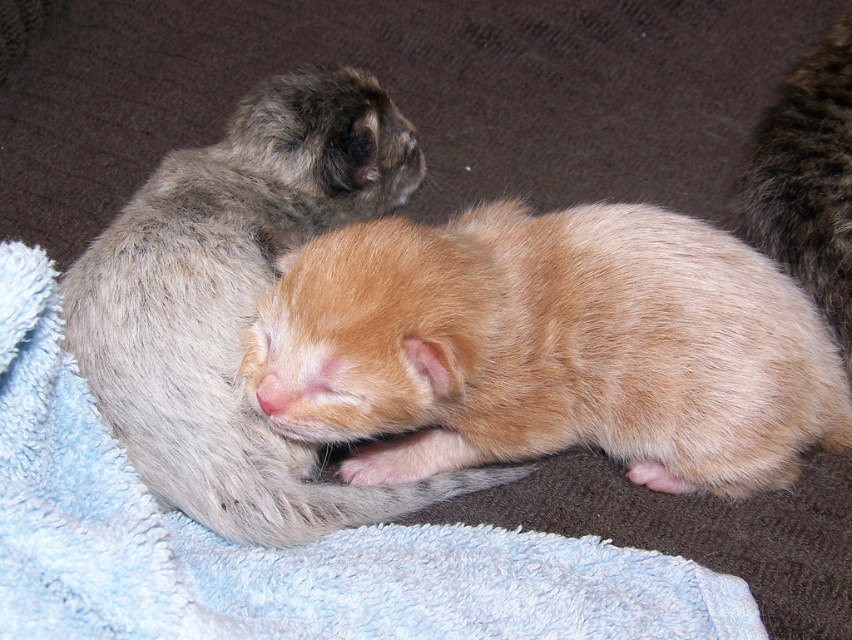
You are a cat owner who wants to place a small toy between the fluffy gray kitten at upper left and the fluffy brown fur at upper right. Based on their heights, which kitten will the toy be closer to?

The fluffy gray kitten at upper left has a greater height compared to the fluffy brown fur at upper right. Therefore, the toy placed between them will be closer to the fluffy brown fur at upper right.

You are a cat owner who wants to move the orange fur kitten at center and the fluffy gray kitten at upper left to a safer spot. Which kitten should you pick up first to avoid disturbing the other?

You should pick up the orange fur kitten at center first because it is below the fluffy gray kitten at upper left, so moving the lower one first would prevent disturbing the upper one.